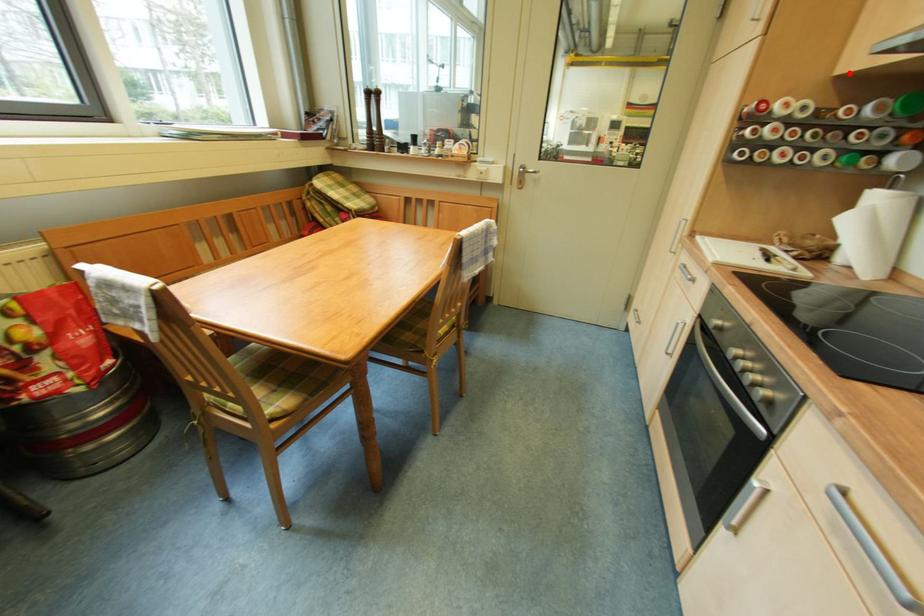
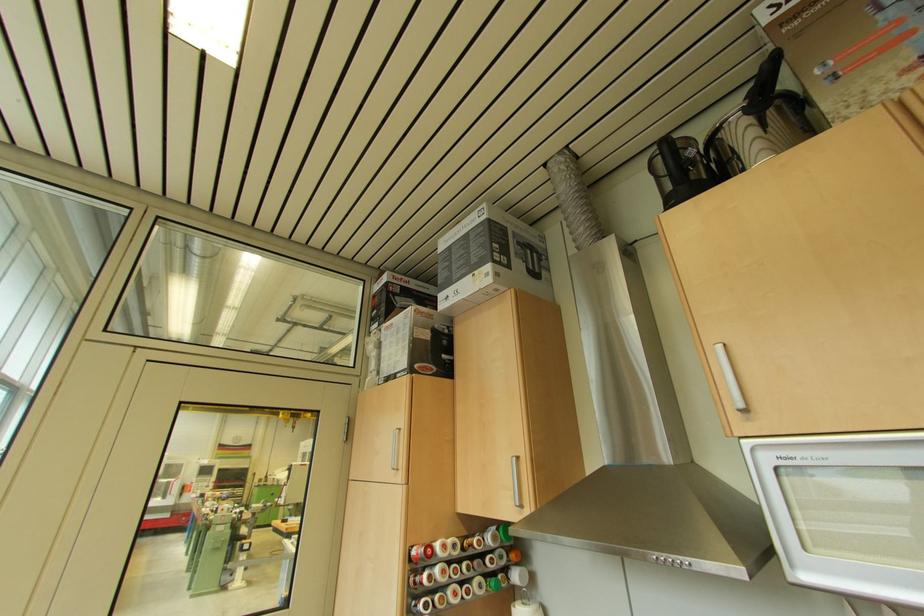
Where in the second image is the point corresponding to the highlighted location from the first image?

(468, 513)